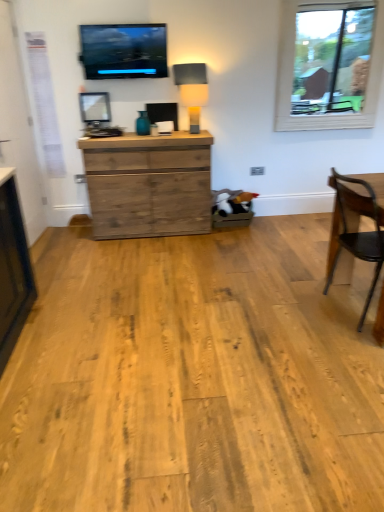
Question: From a real-world perspective, is wooden chair at right positioned above or below rustic wood chest of drawers at center?

Choices:
 (A) below
 (B) above

Answer: (B)

Question: Considering the positions of wooden chair at right and rustic wood chest of drawers at center in the image, is wooden chair at right wider or thinner than rustic wood chest of drawers at center?

Choices:
 (A) wide
 (B) thin

Answer: (A)

Question: Which of these objects is positioned farthest from the clear glass window at upper right?

Choices:
 (A) wooden chair at right
 (B) rustic wood chest of drawers at center
 (C) matte black screen at upper center
 (D) matte beige lampshade at center

Answer: (A)

Question: Which of these objects is positioned farthest from the matte beige lampshade at center?

Choices:
 (A) rustic wood chest of drawers at center
 (B) wooden chair at right
 (C) clear glass window at upper right
 (D) matte black screen at upper center

Answer: (B)